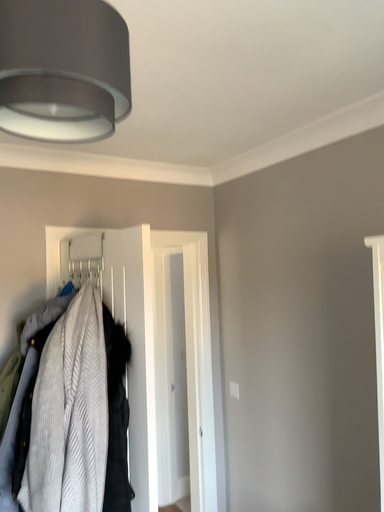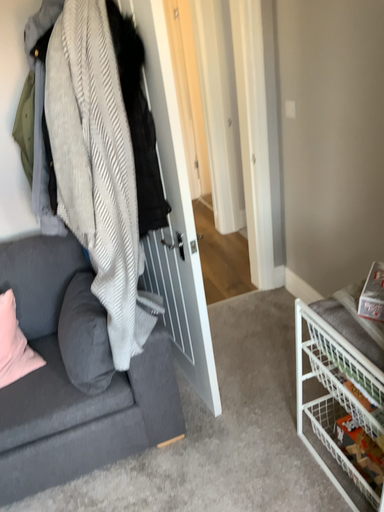
Question: How did the camera likely rotate when shooting the video?

Choices:
 (A) rotated left
 (B) rotated right

Answer: (A)